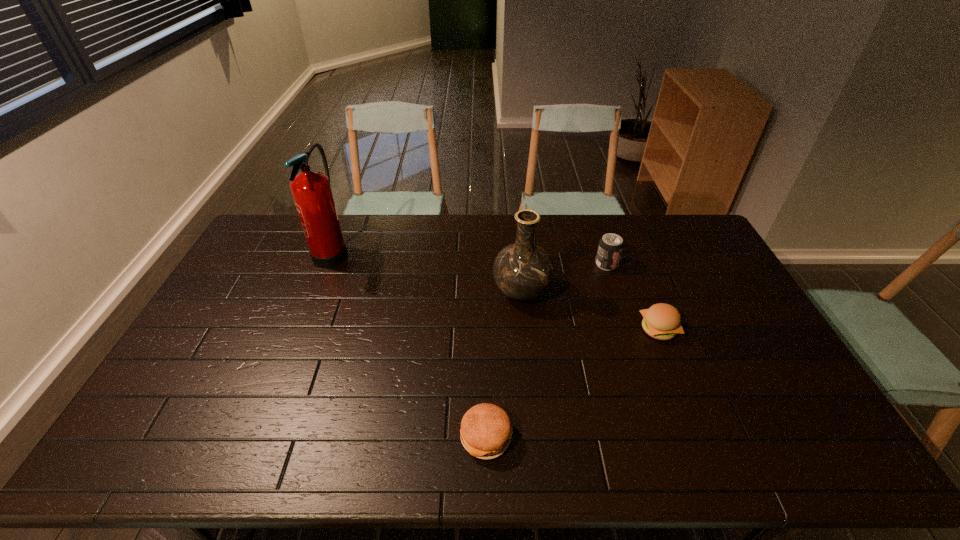
I want to click on free space between the vase and the shortest object, so click(x=504, y=364).

Locate an element on the screen. Image resolution: width=960 pixels, height=540 pixels. free spot between the nearest object and the tallest object is located at coordinates (409, 344).

Locate an element on the screen. The image size is (960, 540). free space that is in between the second tallest object and the fire extinguisher is located at coordinates (x=427, y=271).

At what (x,y) coordinates should I click in order to perform the action: click on free space between the fourth shortest object and the third shortest object. Please return your answer as a coordinate pair (x, y). Looking at the image, I should click on (564, 278).

Find the location of a particular element. The width and height of the screenshot is (960, 540). blank region between the fourth farthest object and the fourth shortest object is located at coordinates (589, 310).

Where is `free spot between the left hamburger and the vase`? The width and height of the screenshot is (960, 540). free spot between the left hamburger and the vase is located at coordinates (504, 364).

Identify the location of vacant region between the soda can and the fourth tallest object. Image resolution: width=960 pixels, height=540 pixels. (633, 296).

Find the location of `free space between the taller hamburger and the third tallest object`. free space between the taller hamburger and the third tallest object is located at coordinates (633, 296).

The image size is (960, 540). In order to click on free space between the third tallest object and the left hamburger in this screenshot , I will do `click(546, 350)`.

Locate which object is the second closest to the third shortest object. Please provide its 2D coordinates. Your answer should be formatted as a tuple, i.e. [(x, y)], where the tuple contains the x and y coordinates of a point satisfying the conditions above.

[(661, 321)]